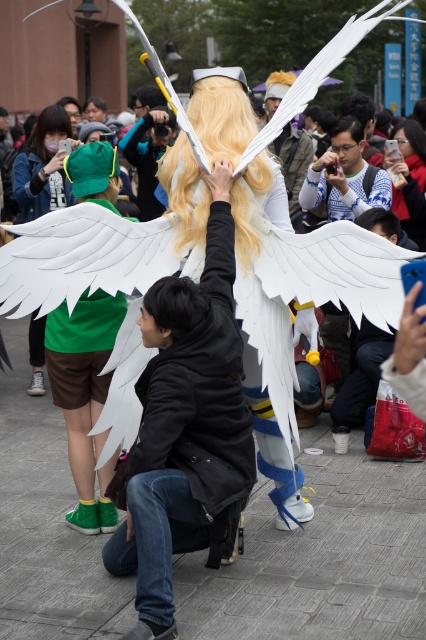
You are a photographer at the event and want to capture a photo where both the blonde hair at center and the green fabric wings at left are visible. Based on their positions, which object should you ensure is closer to the camera to include both in the frame?

The blonde hair at center is positioned on the right side of green fabric wings at left, so to include both in the frame, ensure the green fabric wings at left are closer to the camera.